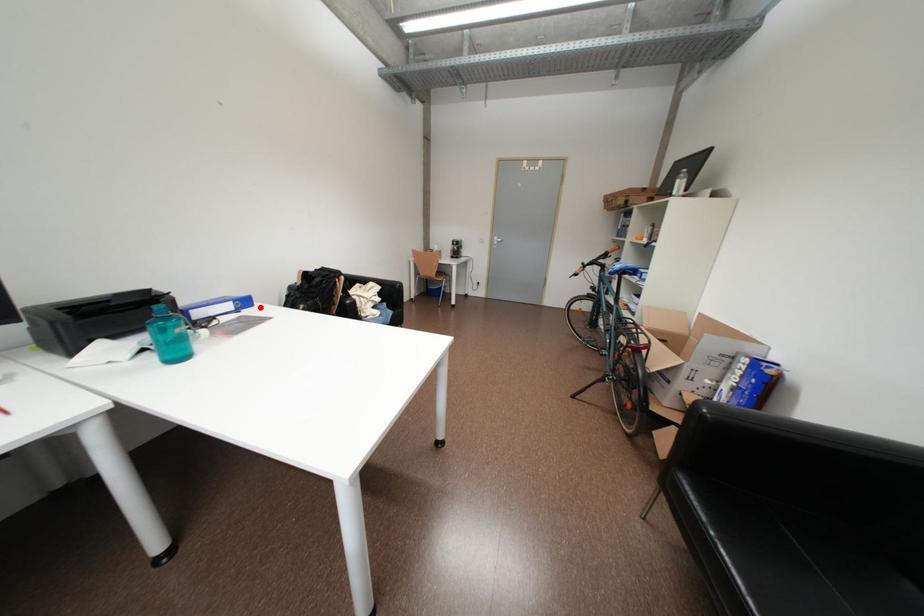
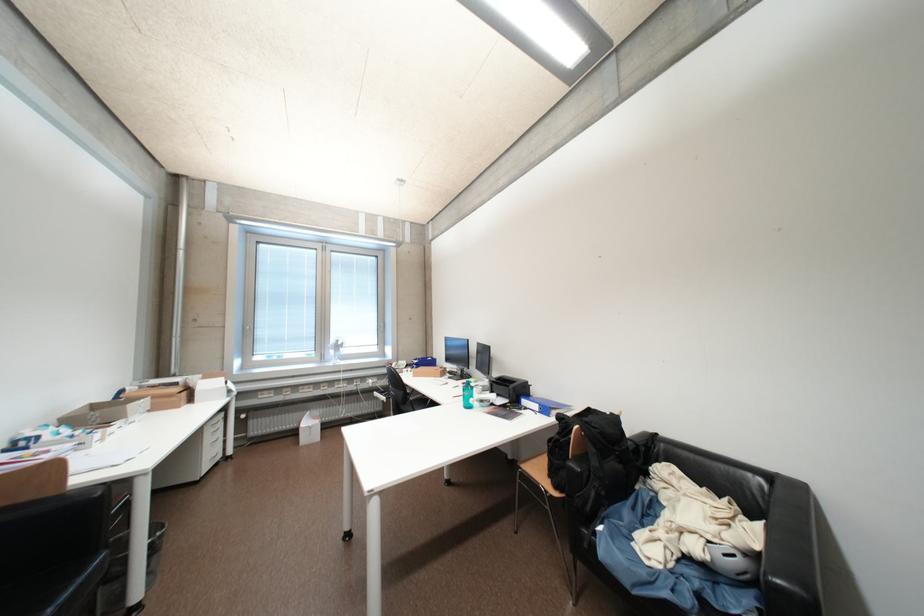
Question: I am providing you with two images of the same scene from different viewpoints. A red point is shown in image1. For the corresponding object point in image2, is it positioned nearer or farther from the camera?

Choices:
 (A) Nearer
 (B) Farther

Answer: (B)